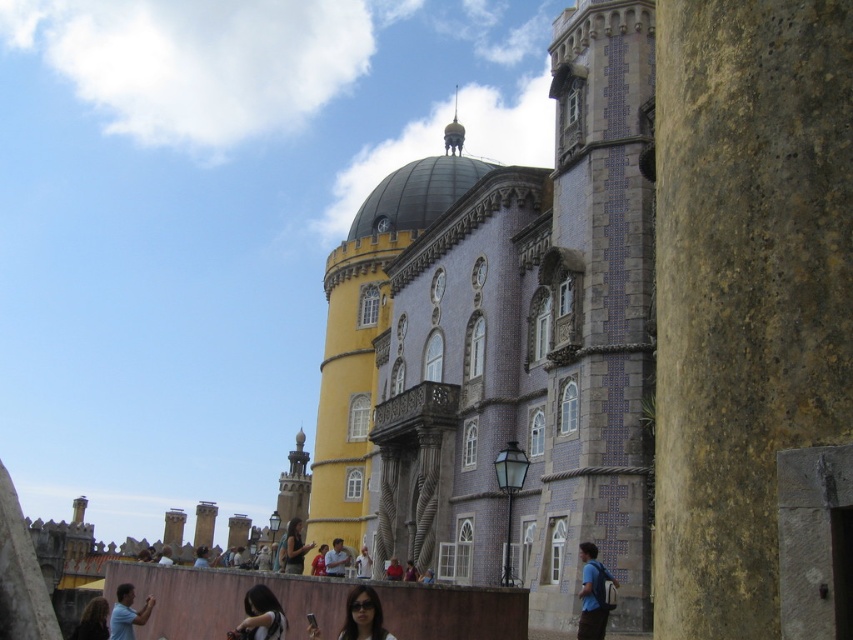
Is dark brown hair at lower left positioned before matte red shirt at center?

Yes, dark brown hair at lower left is closer to the viewer.

How far apart are dark brown hair at lower left and matte red shirt at center?

dark brown hair at lower left is 24.96 meters away from matte red shirt at center.

Locate an element on the screen. The width and height of the screenshot is (853, 640). dark brown hair at lower left is located at coordinates (93, 620).

In the scene shown: Does light brown leather jacket at center have a lesser width compared to matte black shirt at center?

No, light brown leather jacket at center is not thinner than matte black shirt at center.

Who is shorter, light brown leather jacket at center or matte black shirt at center?

Standing shorter between the two is matte black shirt at center.

Who is more distant from viewer, (328, 563) or (389, 570)?

The point (328, 563) is more distant.

Image resolution: width=853 pixels, height=640 pixels. What are the coordinates of `light brown leather jacket at center` in the screenshot? It's located at (335, 560).

Is light brown leather jacket at lower center below smooth blue shirt at center?

Yes.

Who is positioned more to the right, light brown leather jacket at lower center or smooth blue shirt at center?

smooth blue shirt at center is more to the right.

Measure the distance between light brown leather jacket at lower center and camera.

The distance of light brown leather jacket at lower center from camera is 81.63 meters.

Identify the location of light brown leather jacket at lower center. (363, 563).